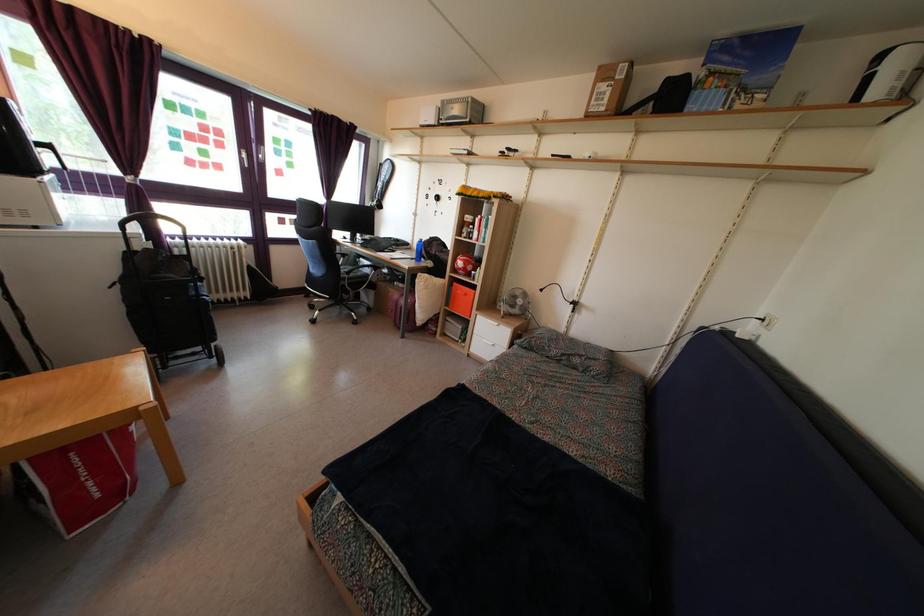
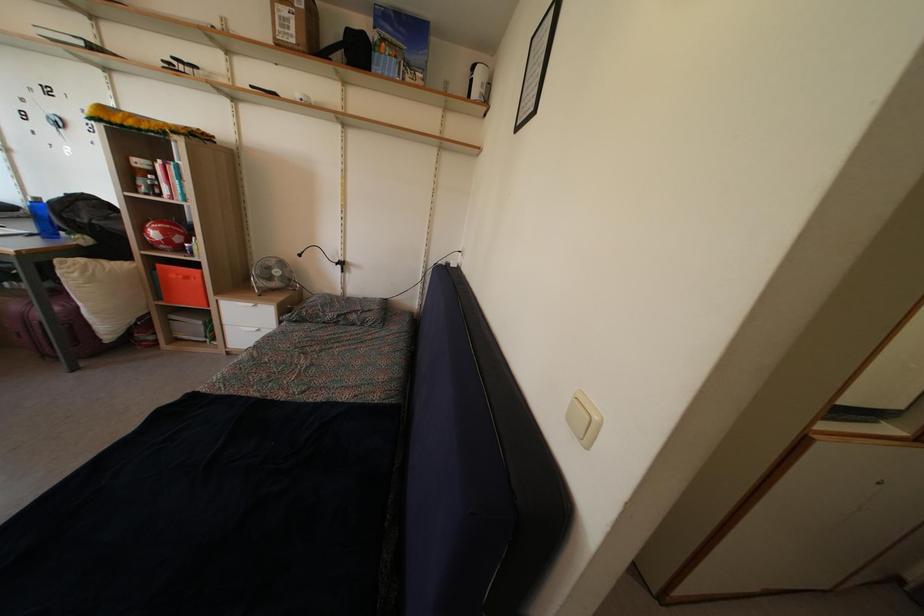
Where in the second image is the point corresponding to (x=468, y=302) from the first image?

(189, 286)